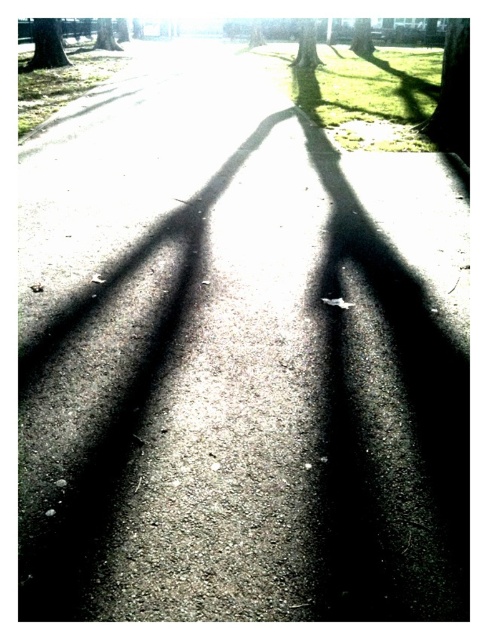
You are a photographer standing at the end of the pathway in the park. You notice two trees at the upper center of your viewfinder labeled as the green textured tree at upper center and the smooth bark tree at upper center. Which tree is positioned more to the right in your view?

The green textured tree at upper center is positioned more to the right compared to the smooth bark tree at upper center.

You are a photographer standing at the lower end of the pathway. You want to take a photo of the green leafy tree at upper center and the smooth bark tree at upper center. Which tree will appear larger in your photo?

The green leafy tree at upper center will appear larger in the photo because it is in front of the smooth bark tree at upper center, making it closer to the camera and thus appear bigger.